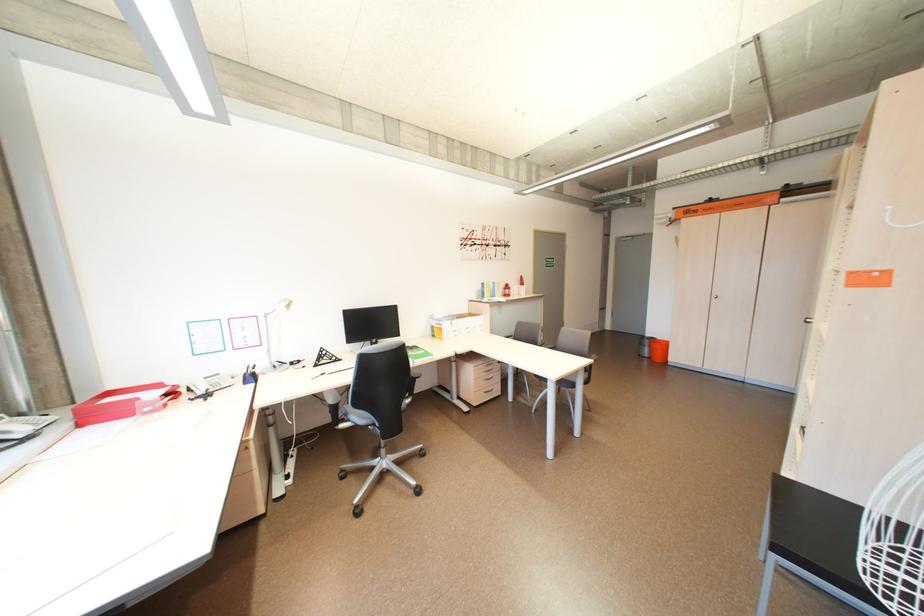
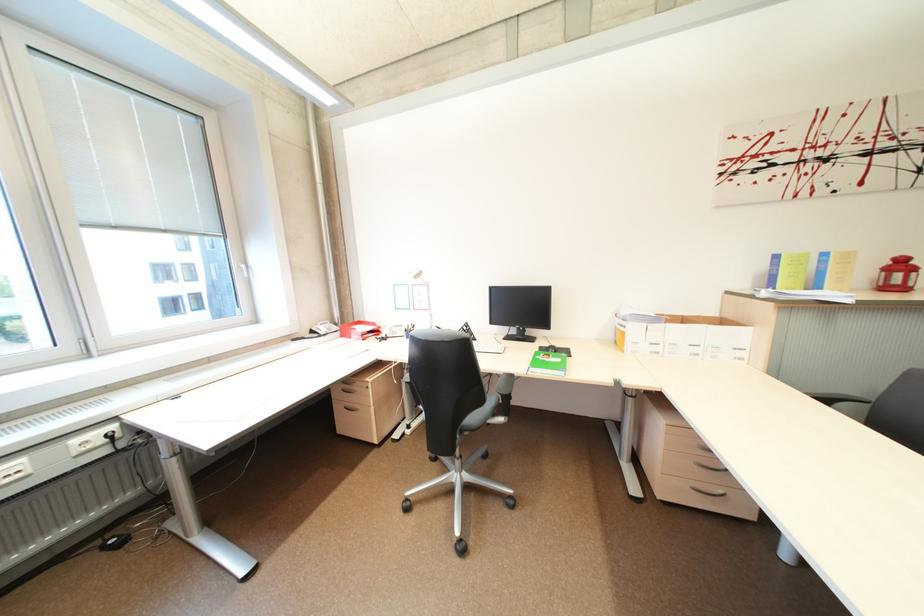
The point at (450, 330) is marked in the first image. Where is the corresponding point in the second image?

(633, 334)